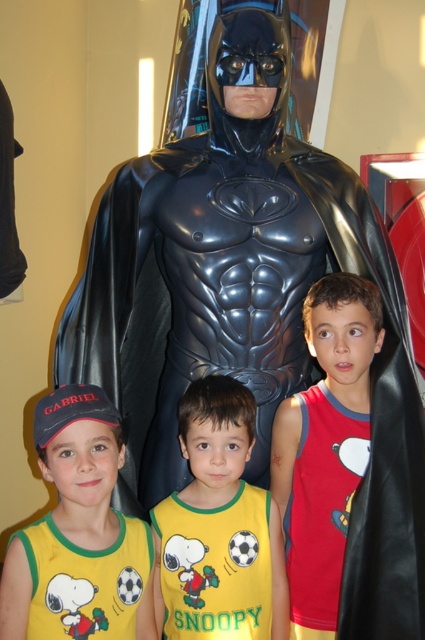
Is yellow jersey at center bigger than yellow-green jersey with snoopy print at lower left?

Yes.

Which of these two, yellow jersey at center or yellow-green jersey with snoopy print at lower left, stands shorter?

Standing shorter between the two is yellow-green jersey with snoopy print at lower left.

Does point (144, 593) come in front of point (50, 602)?

No, it is not.

This screenshot has height=640, width=425. In order to click on yellow jersey at center in this screenshot , I will do `click(79, 532)`.

Does yellow-green t-shirt at center appear on the right side of yellow-green jersey with snoopy print at lower left?

Correct, you'll find yellow-green t-shirt at center to the right of yellow-green jersey with snoopy print at lower left.

Can you confirm if yellow-green t-shirt at center is positioned above yellow-green jersey with snoopy print at lower left?

Yes.

The height and width of the screenshot is (640, 425). I want to click on yellow-green t-shirt at center, so click(x=218, y=529).

The width and height of the screenshot is (425, 640). Describe the element at coordinates (218, 529) in the screenshot. I see `yellow-green t-shirt at center` at that location.

Is yellow-green t-shirt at center to the left of red cotton tank top at center from the viewer's perspective?

Correct, you'll find yellow-green t-shirt at center to the left of red cotton tank top at center.

Which is behind, point (240, 550) or point (340, 493)?

The point (340, 493) is more distant.

Where is `yellow-green t-shirt at center`? The image size is (425, 640). yellow-green t-shirt at center is located at coordinates (218, 529).